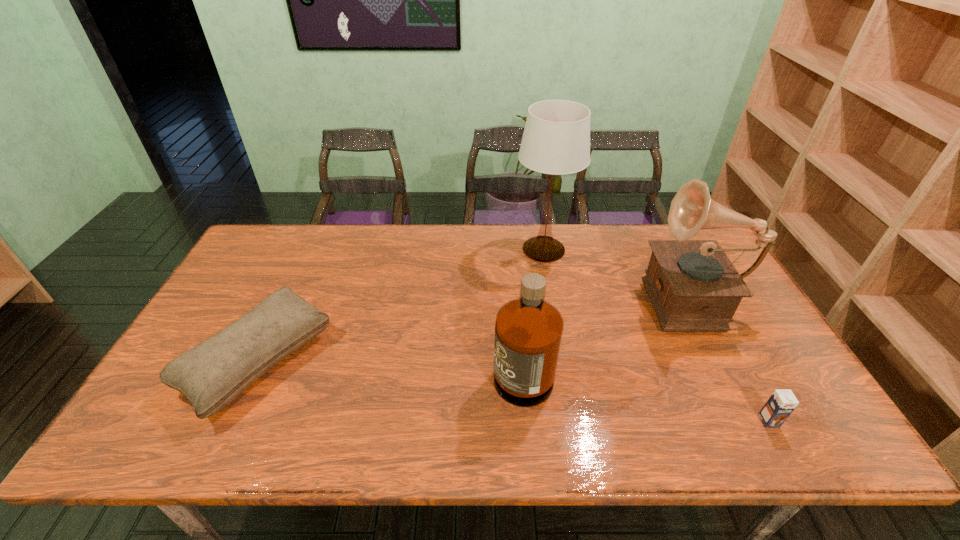
I want to click on free location located 0.080m on the front label of the third tallest object, so click(x=462, y=363).

What are the coordinates of `free location located on the front label of the third tallest object` in the screenshot? It's located at (466, 363).

Where is `blank area located 0.270m on the front label of the third tallest object`? The height and width of the screenshot is (540, 960). blank area located 0.270m on the front label of the third tallest object is located at coordinates (388, 363).

At what (x,y) coordinates should I click in order to perform the action: click on blank space located 0.300m on the back of the leftmost object. Please return your answer as a coordinate pair (x, y). Looking at the image, I should click on (314, 243).

The width and height of the screenshot is (960, 540). Find the location of `table lamp located in the far edge section of the desktop`. table lamp located in the far edge section of the desktop is located at coordinates [x=556, y=141].

This screenshot has height=540, width=960. Identify the location of record player situated at the far edge. 693,286.

This screenshot has width=960, height=540. What are the coordinates of `cushion at the near edge` in the screenshot? It's located at point(212,374).

Identify the location of chocolate milk that is at the near edge. This screenshot has width=960, height=540. (780, 405).

Locate an element on the screen. Image resolution: width=960 pixels, height=540 pixels. object positioned at the left edge is located at coordinates coord(212,374).

The image size is (960, 540). In order to click on record player that is at the right edge in this screenshot , I will do `click(693, 286)`.